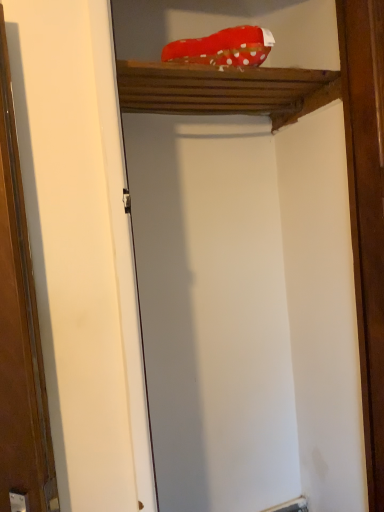
Find the location of a particular element. wooden shelf at upper center is located at coordinates (228, 70).

Measure the distance between wooden shelf at upper center and camera.

A distance of 3.62 feet exists between wooden shelf at upper center and camera.

The width and height of the screenshot is (384, 512). Describe the element at coordinates (228, 70) in the screenshot. I see `wooden shelf at upper center` at that location.

The width and height of the screenshot is (384, 512). What do you see at coordinates (366, 210) in the screenshot?
I see `brown wood at right` at bounding box center [366, 210].

Measure the distance between point (x=374, y=449) and camera.

Point (x=374, y=449) is 1.32 meters away from camera.

Locate an element on the screen. This screenshot has width=384, height=512. brown wood at right is located at coordinates (366, 210).

Locate an element on the screen. This screenshot has height=512, width=384. wooden shelf at upper center is located at coordinates pos(228,70).

Visually, is wooden shelf at upper center positioned to the left or to the right of brown wood at right?

From the image, it's evident that wooden shelf at upper center is to the left of brown wood at right.

Who is more distant, wooden shelf at upper center or brown wood at right?

brown wood at right is further away from the camera.

Which is closer to the camera, (152, 29) or (370, 161)?

The point (370, 161) is in front.

From the image's perspective, is wooden shelf at upper center located beneath brown wood at right?

Actually, wooden shelf at upper center appears above brown wood at right in the image.

From a real-world perspective, is wooden shelf at upper center under brown wood at right?

No, from a real-world perspective, wooden shelf at upper center is not below brown wood at right.

Which object is wider, wooden shelf at upper center or brown wood at right?

wooden shelf at upper center.

Is wooden shelf at upper center taller or shorter than brown wood at right?

Clearly, wooden shelf at upper center is shorter compared to brown wood at right.

Considering the sizes of objects wooden shelf at upper center and brown wood at right in the image provided, who is smaller, wooden shelf at upper center or brown wood at right?

brown wood at right.

Is wooden shelf at upper center outside of brown wood at right?

That's correct, wooden shelf at upper center is outside of brown wood at right.

Are wooden shelf at upper center and brown wood at right located far from each other?

Actually, wooden shelf at upper center and brown wood at right are a little close together.

Is wooden shelf at upper center aimed at brown wood at right?

No, wooden shelf at upper center is not facing towards brown wood at right.

Can you tell me how much wooden shelf at upper center and brown wood at right differ in facing direction?

wooden shelf at upper center and brown wood at right are facing 90.8 degrees away from each other.

Find the location of `barn door that appears behind the wooden shelf at upper center`. barn door that appears behind the wooden shelf at upper center is located at coordinates (366, 210).

In the image, is brown wood at right on the left side or the right side of wooden shelf at upper center?

Clearly, brown wood at right is on the right of wooden shelf at upper center in the image.

Is the depth of brown wood at right greater than that of wooden shelf at upper center?

Yes, the depth of brown wood at right is greater than that of wooden shelf at upper center.

Is point (369, 243) closer or farther from the camera than point (124, 49)?

Point (369, 243).

In the scene shown: From the image's perspective, which one is positioned lower, brown wood at right or wooden shelf at upper center?

From the image's view, brown wood at right is below.

From a real-world perspective, is brown wood at right physically located above or below wooden shelf at upper center?

Clearly, from a real-world perspective, brown wood at right is below wooden shelf at upper center.

Considering the relative sizes of brown wood at right and wooden shelf at upper center in the image provided, is brown wood at right wider than wooden shelf at upper center?

Incorrect, the width of brown wood at right does not surpass that of wooden shelf at upper center.

Considering the sizes of objects brown wood at right and wooden shelf at upper center in the image provided, who is taller, brown wood at right or wooden shelf at upper center?

brown wood at right is taller.

Considering the relative sizes of brown wood at right and wooden shelf at upper center in the image provided, is brown wood at right smaller than wooden shelf at upper center?

Indeed, brown wood at right has a smaller size compared to wooden shelf at upper center.

In the scene shown: Would you say brown wood at right is outside wooden shelf at upper center?

brown wood at right is positioned outside wooden shelf at upper center.

Consider the image. Is brown wood at right positioned far away from wooden shelf at upper center?

That's not correct — brown wood at right is a little close to wooden shelf at upper center.

Is brown wood at right oriented towards wooden shelf at upper center?

No, brown wood at right is not aimed at wooden shelf at upper center.

Measure the distance from brown wood at right to wooden shelf at upper center.

brown wood at right is 42.97 centimeters from wooden shelf at upper center.

Find the location of a particular element. Image resolution: width=384 pixels, height=512 pixels. cabinet above the brown wood at right (from a real-world perspective) is located at coordinates (228, 70).

Locate an element on the screen. This screenshot has height=512, width=384. barn door located behind the wooden shelf at upper center is located at coordinates (366, 210).

Image resolution: width=384 pixels, height=512 pixels. I want to click on cabinet that appears on the left of brown wood at right, so click(228, 70).